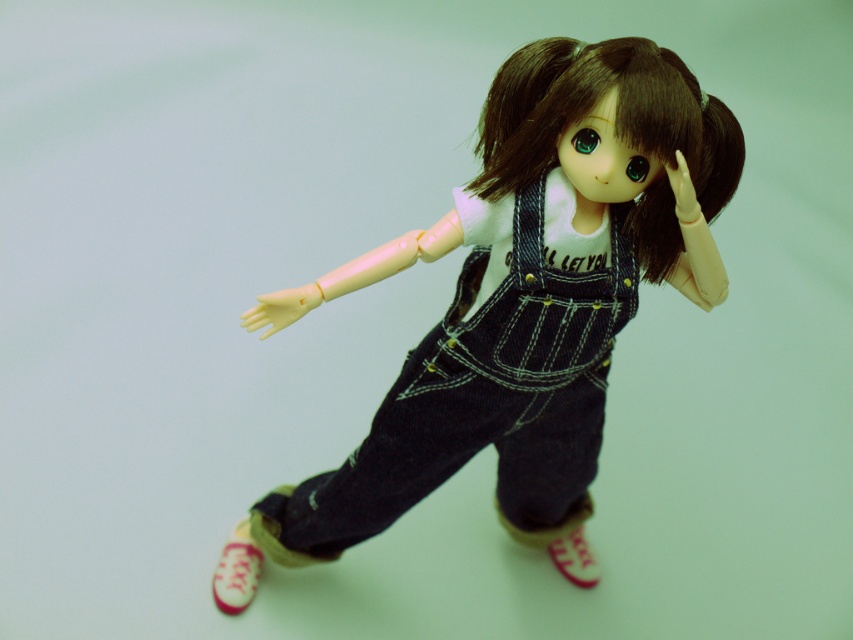
Please provide the 2D coordinates of the denim overalls at center in the image.

The denim overalls at center are located at the 2D coordinates of point (531,292).

You are an artist sketching the doll and want to ensure proper perspective. Which of the two points, point (523, 116) or point (247, 541), is closer to you?

Point (523, 116) is closer to the viewer than point (247, 541).

You are a photographer adjusting the lighting in the studio. You need to place a spotlight exactly at point [531,292]. What object will be illuminated by this spotlight?

The denim overalls at center will be illuminated by the spotlight placed at point [531,292].